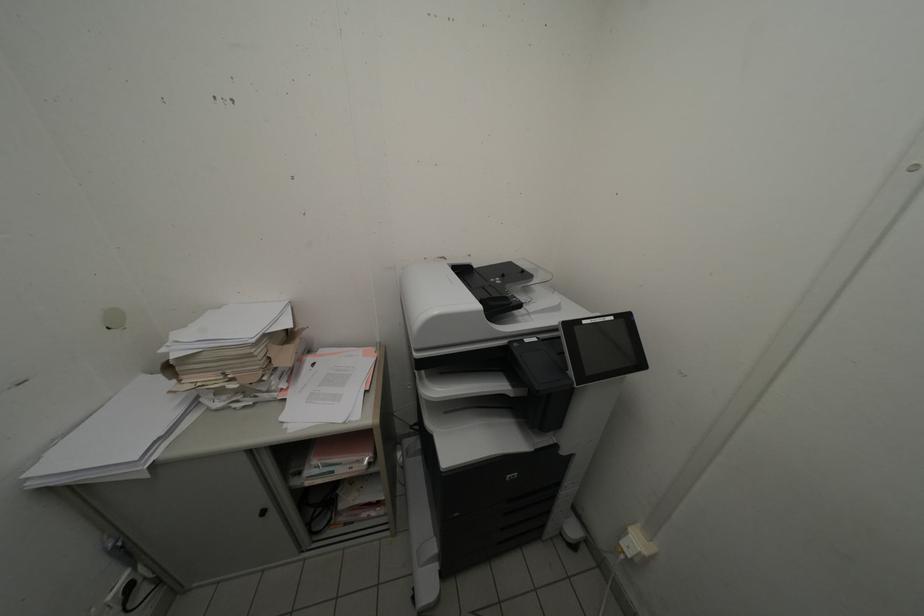
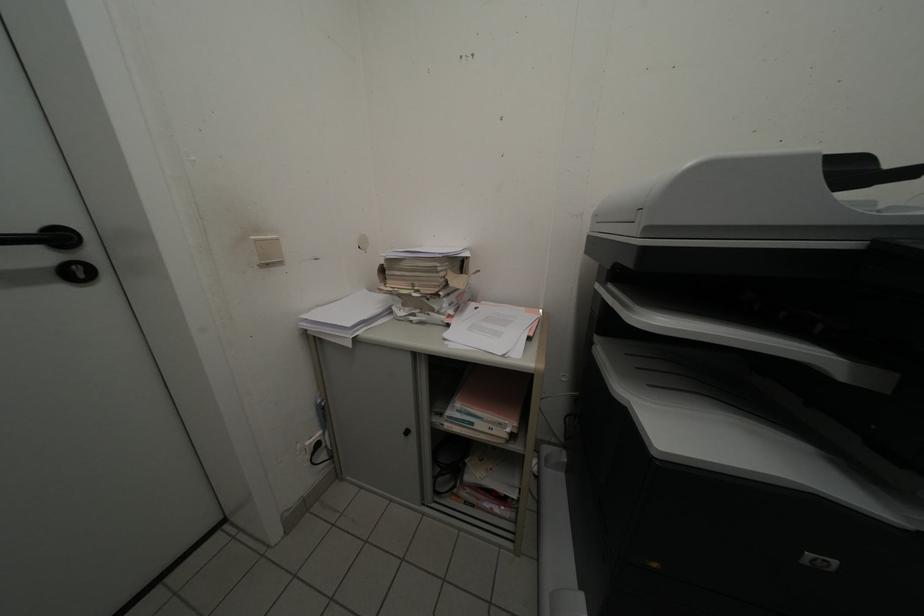
Question: How did the camera likely rotate?

Choices:
 (A) Left
 (B) Right
 (C) Up
 (D) Down

Answer: (A)